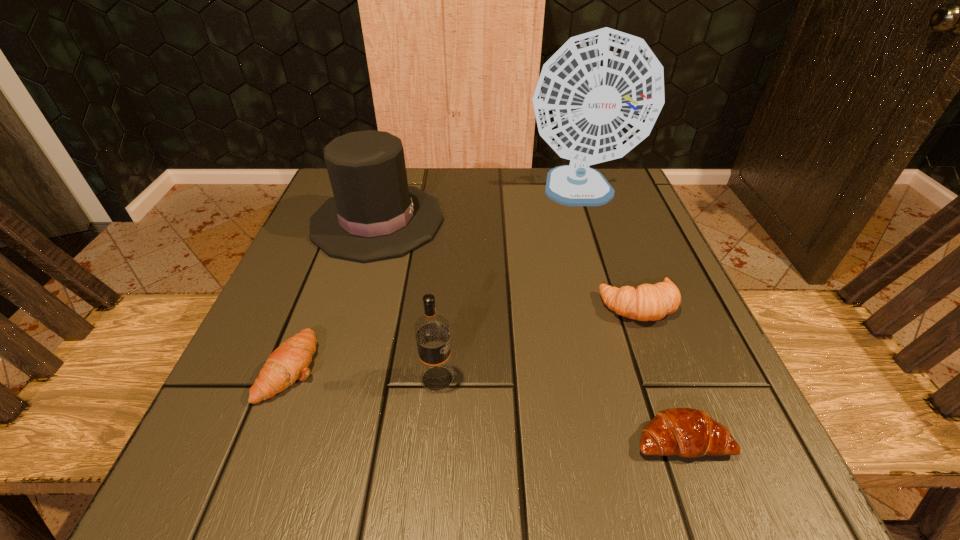
The height and width of the screenshot is (540, 960). In order to click on blank space located on the left of the tallest crescent roll in this screenshot , I will do `click(555, 305)`.

This screenshot has height=540, width=960. I want to click on free space located 0.130m on the left of the nearest object, so click(535, 439).

This screenshot has width=960, height=540. I want to click on vacant space positioned on the back of the leftmost crescent roll, so click(x=339, y=244).

The height and width of the screenshot is (540, 960). Find the location of `fan at the far edge`. fan at the far edge is located at coordinates tap(599, 95).

Locate an element on the screen. This screenshot has height=540, width=960. dress hat located in the far edge section of the desktop is located at coordinates (374, 214).

Where is `object present at the near edge`? object present at the near edge is located at coordinates (685, 432).

Identify the location of dress hat at the left edge. The image size is (960, 540). (374, 214).

This screenshot has width=960, height=540. What are the coordinates of `crescent roll situated at the left edge` in the screenshot? It's located at (289, 362).

The width and height of the screenshot is (960, 540). Identify the location of fan at the right edge. (599, 95).

I want to click on object located in the far left corner section of the desktop, so click(x=374, y=214).